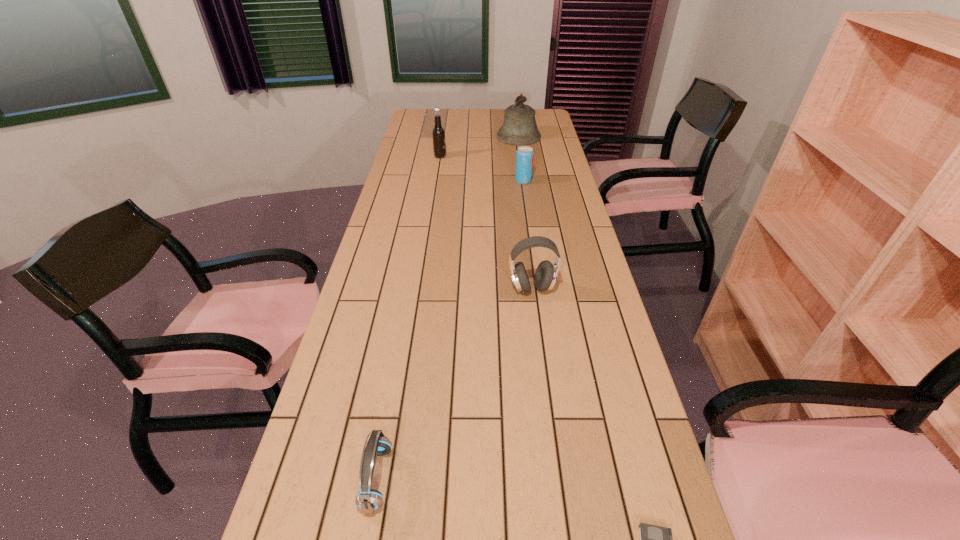
I want to click on free region located on the ear cups of the right headset, so coord(540,348).

Identify the location of vacant space located 0.260m on the left of the fourth tallest object. tap(451, 180).

You are a GUI agent. You are given a task and a screenshot of the screen. Output one action in this format:
    pyautogui.click(x=<x>, y=<y>)
    Task: Click on the free point located 0.310m on the ear cups of the fifth tallest object
    The image size is (960, 540).
    Given the screenshot: What is the action you would take?
    pyautogui.click(x=544, y=478)

Image resolution: width=960 pixels, height=540 pixels. Identify the location of object that is at the left edge. (369, 500).

At what (x,y) coordinates should I click in order to perform the action: click on bell positioned at the right edge. Please return your answer as a coordinate pair (x, y). The image size is (960, 540). Looking at the image, I should click on (519, 129).

Locate an element on the screen. This screenshot has height=540, width=960. headset located at the right edge is located at coordinates (546, 273).

Locate an element on the screen. soda can at the right edge is located at coordinates (524, 158).

Where is `free space at the left edge of the desktop`? This screenshot has width=960, height=540. free space at the left edge of the desktop is located at coordinates (411, 183).

In the image, there is a desktop. At what (x,y) coordinates should I click in order to perform the action: click on blank space at the right edge. Please return your answer as a coordinate pair (x, y). Looking at the image, I should click on (547, 231).

Locate an element on the screen. The height and width of the screenshot is (540, 960). vacant region at the far left corner is located at coordinates (416, 116).